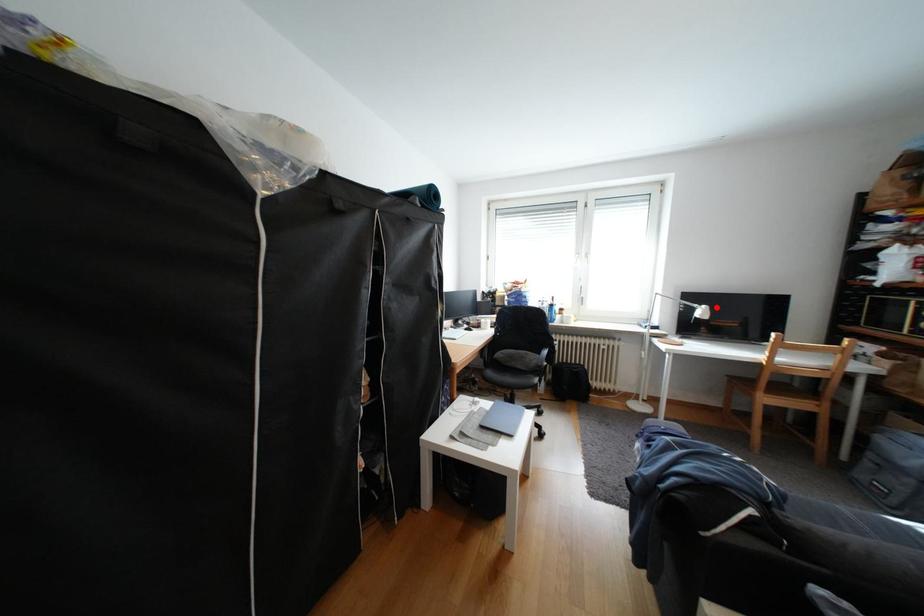
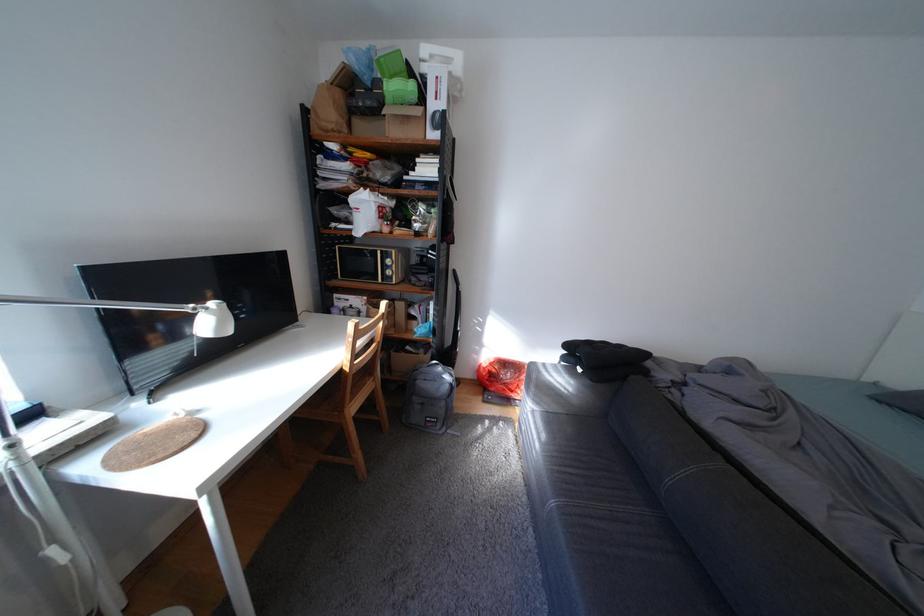
In the second image, find the point that corresponds to the highlighted location in the first image.

(225, 305)